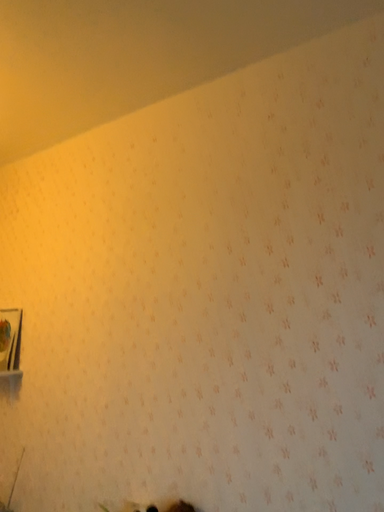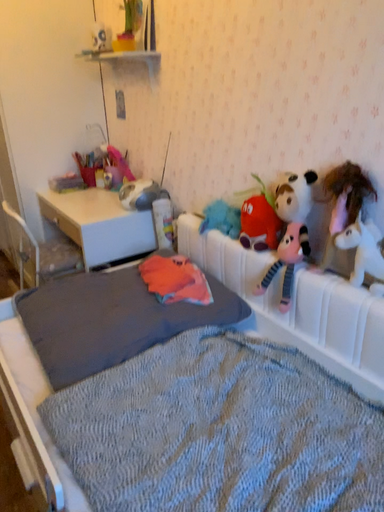
Question: How did the camera likely rotate when shooting the video?

Choices:
 (A) rotated left
 (B) rotated right

Answer: (A)